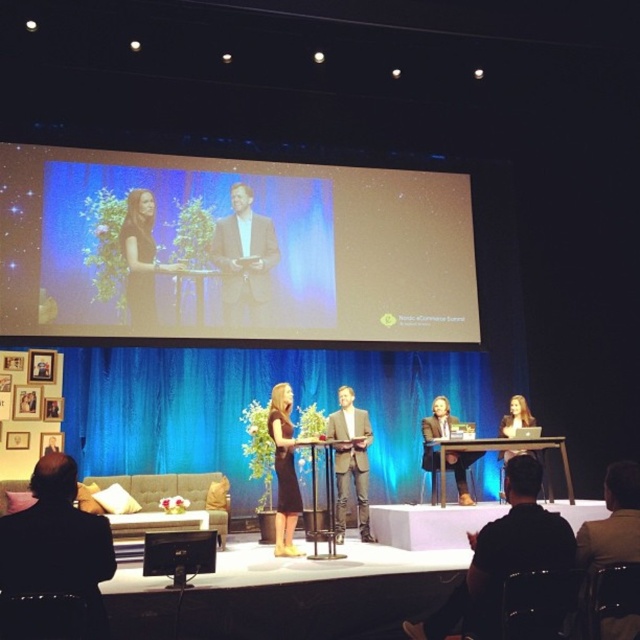
You are an event coordinator standing at the back of the stage. You need to move from your current position to the black dress at left and then to the matte black podium at center. Which object should you approach first to reach both without backtracking?

You should approach the black dress at left first because it is closer to you than the matte black podium at center, which is further away.

You are a stagehand preparing to move a prop from the audience area to the stage. The prop needs to be placed exactly where the black leather jacket at lower left is currently located. According to the coordinates provided, where should you position the prop?

The black leather jacket at lower left is located at point 0.850 on the x and 0.091 on the y coordinates, so you should position the prop at those exact coordinates.